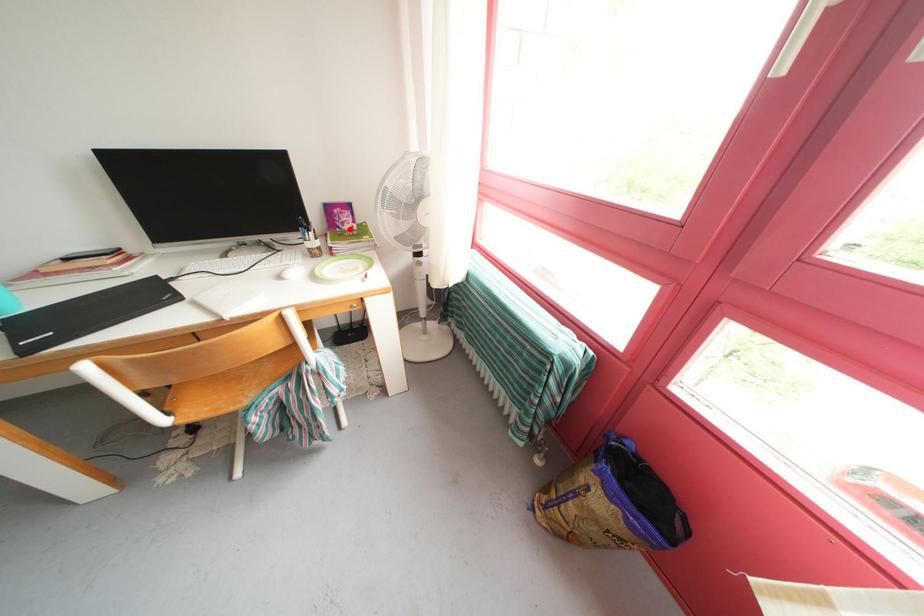
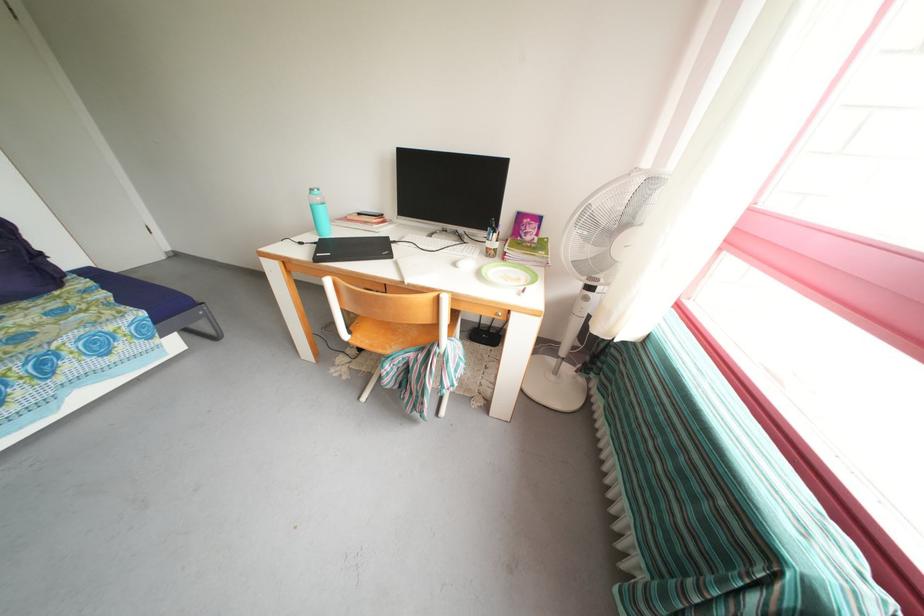
Where in the second image is the point corresponding to the highlighted location from the first image?

(532, 238)